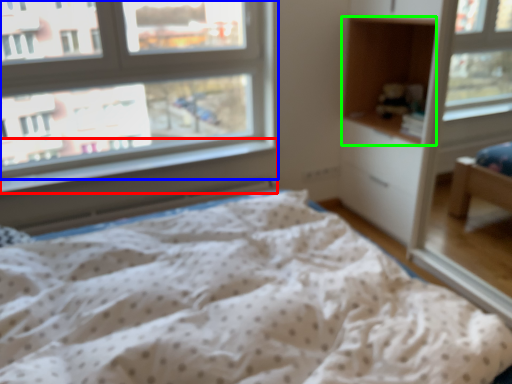
Question: Which object is positioned farthest from window sill (highlighted by a red box)? Select from window (highlighted by a blue box) and cabinet (highlighted by a green box).

Choices:
 (A) window
 (B) cabinet

Answer: (B)